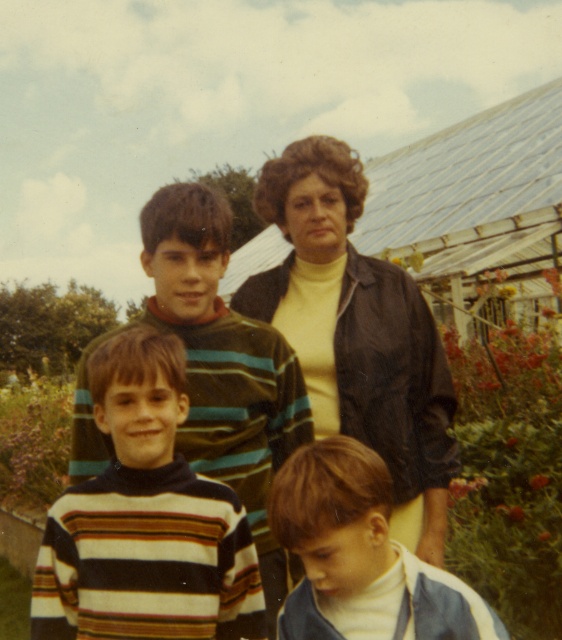
Question: Can you confirm if striped turtleneck sweater at center is positioned above denim jacket at lower right?

Choices:
 (A) no
 (B) yes

Answer: (B)

Question: Which of the following is the closest to the observer?

Choices:
 (A) striped wool sweater at center
 (B) matte black jacket at center
 (C) striped turtleneck sweater at center
 (D) denim jacket at lower right

Answer: (D)

Question: Which point is farther to the camera?

Choices:
 (A) matte black jacket at center
 (B) denim jacket at lower right

Answer: (A)

Question: Which of the following is the closest to the observer?

Choices:
 (A) striped wool sweater at center
 (B) striped turtleneck sweater at center
 (C) matte black jacket at center

Answer: (B)

Question: Is striped turtleneck sweater at center positioned in front of denim jacket at lower right?

Choices:
 (A) no
 (B) yes

Answer: (A)

Question: Is striped wool sweater at center below striped turtleneck sweater at center?

Choices:
 (A) no
 (B) yes

Answer: (A)